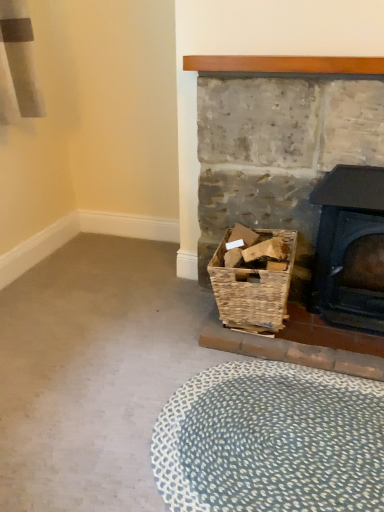
Image resolution: width=384 pixels, height=512 pixels. Identify the location of free spot to the left of rustic wicker basket at lower right. (153, 321).